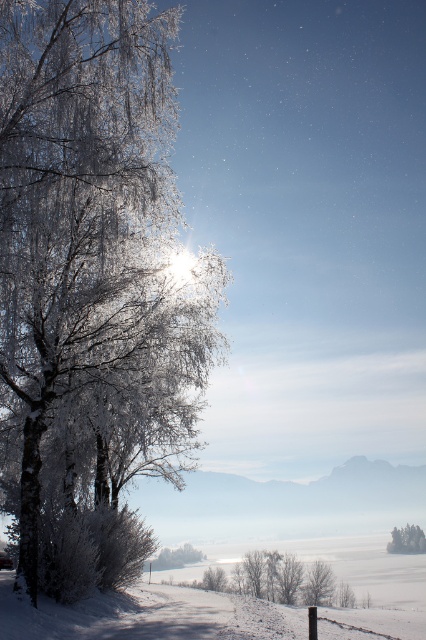
Question: Which point appears farthest from the camera in this image?

Choices:
 (A) (49, 1)
 (B) (386, 547)
 (C) (158, 563)

Answer: (B)

Question: Can you confirm if white frosty tree at lower center is bigger than white frosty tree at lower right?

Choices:
 (A) yes
 (B) no

Answer: (B)

Question: Is white frosty tree at lower center bigger than white frosty tree at lower right?

Choices:
 (A) yes
 (B) no

Answer: (B)

Question: Considering the relative positions of frosted glass tree at left and white frosty tree at lower center in the image provided, where is frosted glass tree at left located with respect to white frosty tree at lower center?

Choices:
 (A) left
 (B) right

Answer: (B)

Question: Which of the following is the closest to the observer?

Choices:
 (A) (389, 544)
 (B) (2, 248)

Answer: (B)

Question: Estimate the real-world distances between objects in this image. Which object is closer to the white frosty tree at lower center?

Choices:
 (A) frosted glass tree at left
 (B) white frosty tree at lower right

Answer: (B)